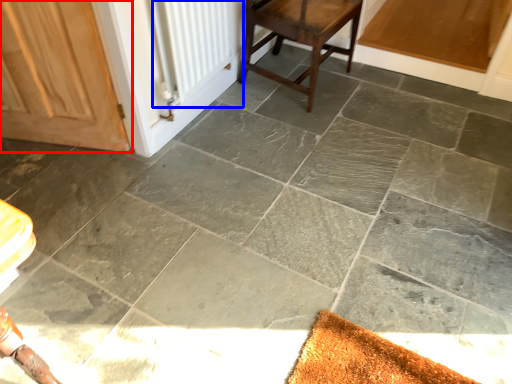
Question: Among these objects, which one is farthest to the camera, door (highlighted by a red box) or radiator (highlighted by a blue box)?

Choices:
 (A) door
 (B) radiator

Answer: (B)